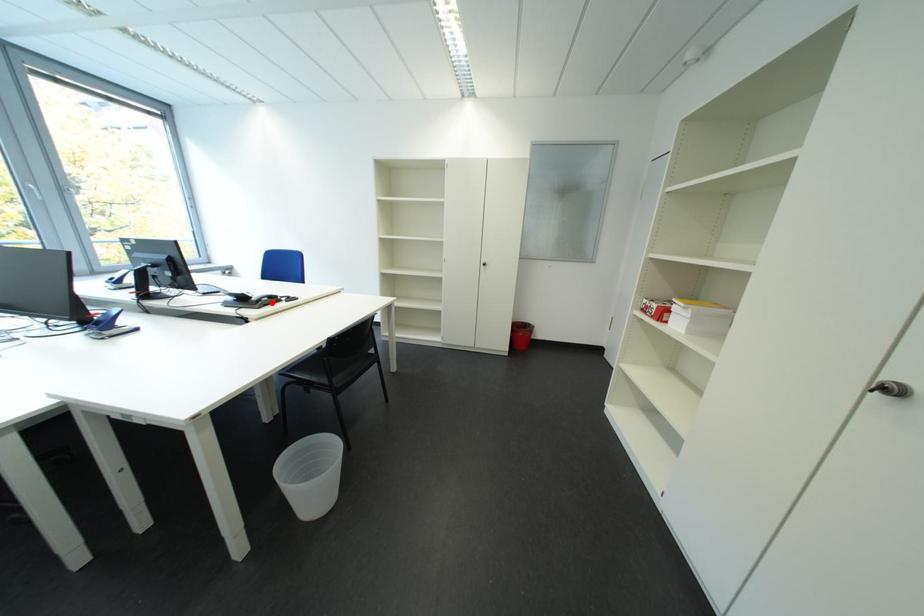
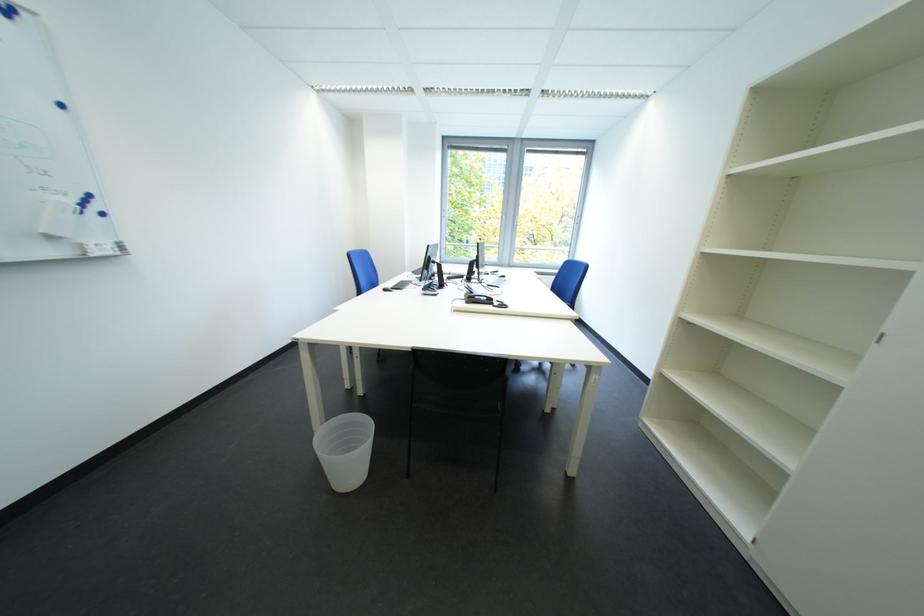
Where in the second image is the point corresponding to the highlighted location from the first image?

(485, 300)